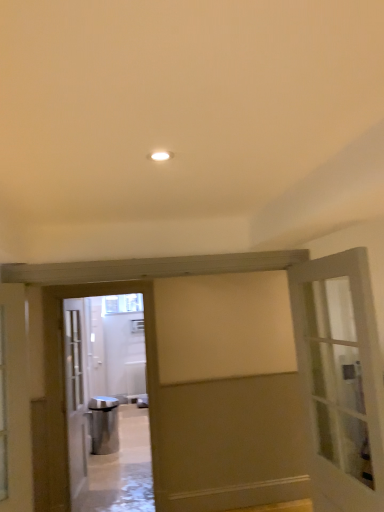
Question: Choose the correct answer: Is clear glass window at center inside matte gray door at right, the 1th door when ordered from front to back, or outside it?

Choices:
 (A) outside
 (B) inside

Answer: (A)

Question: Considering the positions of point (130, 297) and point (327, 460), is point (130, 297) closer or farther from the camera than point (327, 460)?

Choices:
 (A) farther
 (B) closer

Answer: (A)

Question: Which object is positioned closest to the silver metallic elevator at center?

Choices:
 (A) clear glass window at center
 (B) matte gray door at right, the 1th door when ordered from front to back
 (C) white glass door at left, the 2th door when ordered from front to back

Answer: (A)

Question: Which object is positioned closest to the silver metallic elevator at center?

Choices:
 (A) clear glass window at center
 (B) white glass door at left, the 2th door when ordered from front to back
 (C) matte gray door at right, arranged as the 2th door when viewed from the back

Answer: (A)